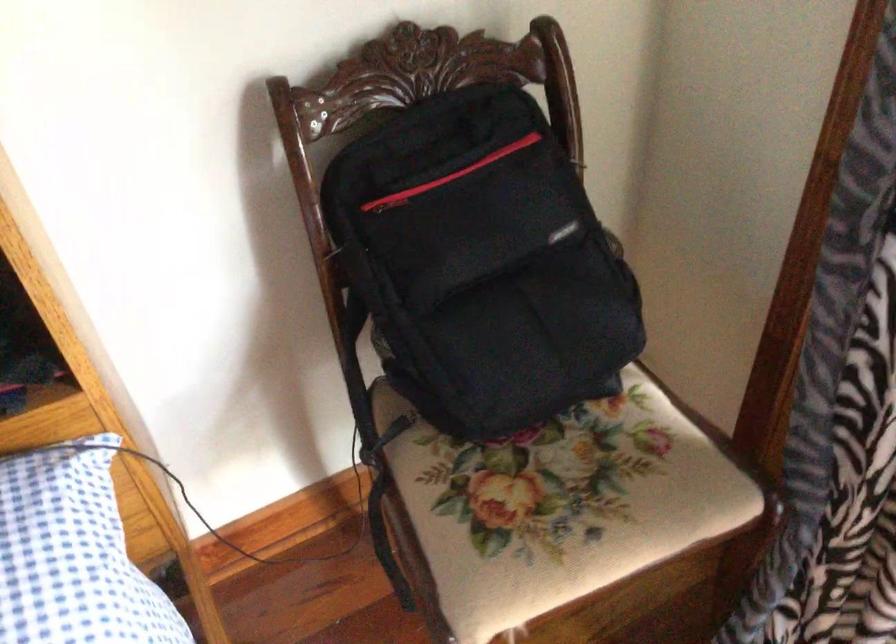
Image resolution: width=896 pixels, height=644 pixels. I want to click on chair sitting surface, so click(x=556, y=506).